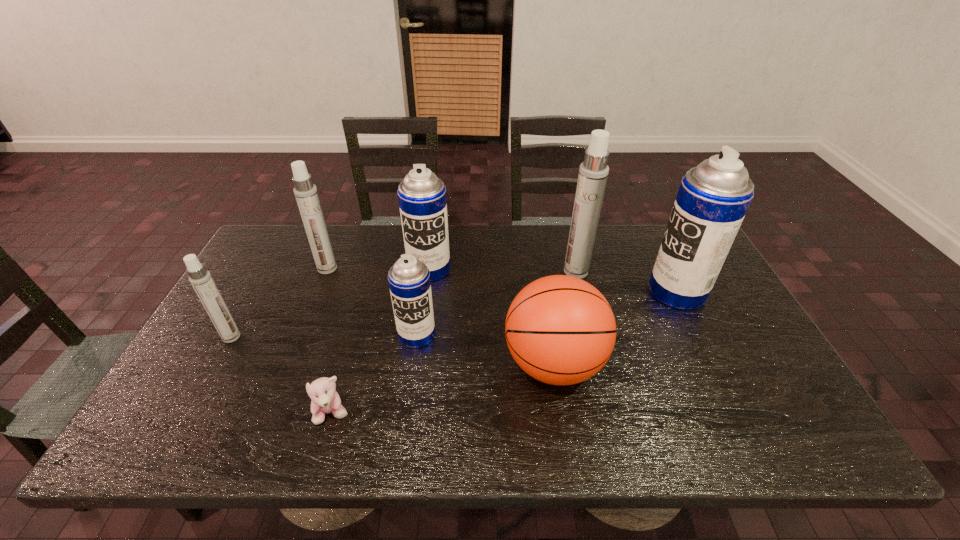
The width and height of the screenshot is (960, 540). In order to click on aerosol can that is the closest to the biggest white aerosol can in this screenshot , I will do `click(713, 198)`.

Identify the location of white aerosol can object that ranks as the closest to the fifth aerosol can from left to right. (x=306, y=194).

Select which white aerosol can is the second closest to the leftmost object. Please provide its 2D coordinates. Your answer should be formatted as a tuple, i.e. [(x, y)], where the tuple contains the x and y coordinates of a point satisfying the conditions above.

[(593, 172)]

Identify which blue aerosol can is located as the third nearest to the seventh object from right to left. Please provide its 2D coordinates. Your answer should be formatted as a tuple, i.e. [(x, y)], where the tuple contains the x and y coordinates of a point satisfying the conditions above.

[(713, 198)]

You are a GUI agent. You are given a task and a screenshot of the screen. Output one action in this format:
    pyautogui.click(x=<x>, y=<y>)
    Task: Click on the third closest blue aerosol can relative to the basketball
    
    Given the screenshot: What is the action you would take?
    pyautogui.click(x=422, y=199)

Locate an element on the screen. vacant space that satisfies the following two spatial constraints: 1. on the label side of the second smallest blue aerosol can; 2. on the right side of the biggest white aerosol can is located at coordinates (429, 272).

The width and height of the screenshot is (960, 540). What are the coordinates of `vacant space that satisfies the following two spatial constraints: 1. on the label side of the rightmost blue aerosol can; 2. at the face of the shortest object` in the screenshot? It's located at (737, 414).

The width and height of the screenshot is (960, 540). Identify the location of free spot that satisfies the following two spatial constraints: 1. on the label side of the nearest blue aerosol can; 2. on the right side of the orange basketball. (413, 364).

Where is `vacant space that satisfies the following two spatial constraints: 1. on the label side of the basketball; 2. on the left side of the second biggest blue aerosol can`? vacant space that satisfies the following two spatial constraints: 1. on the label side of the basketball; 2. on the left side of the second biggest blue aerosol can is located at coordinates (417, 364).

Image resolution: width=960 pixels, height=540 pixels. Identify the location of vacant space that satisfies the following two spatial constraints: 1. on the label side of the orange basketball; 2. on the left side of the second biggest blue aerosol can. (417, 364).